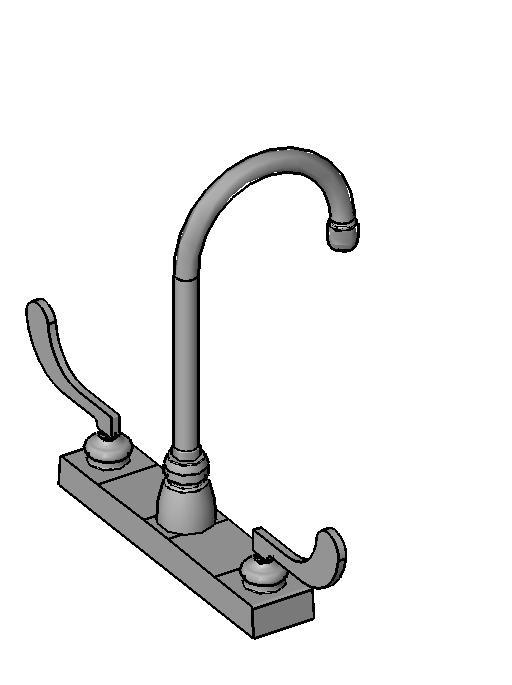
Find the location of `1 grey faucet`. 1 grey faucet is located at coordinates (192, 416).